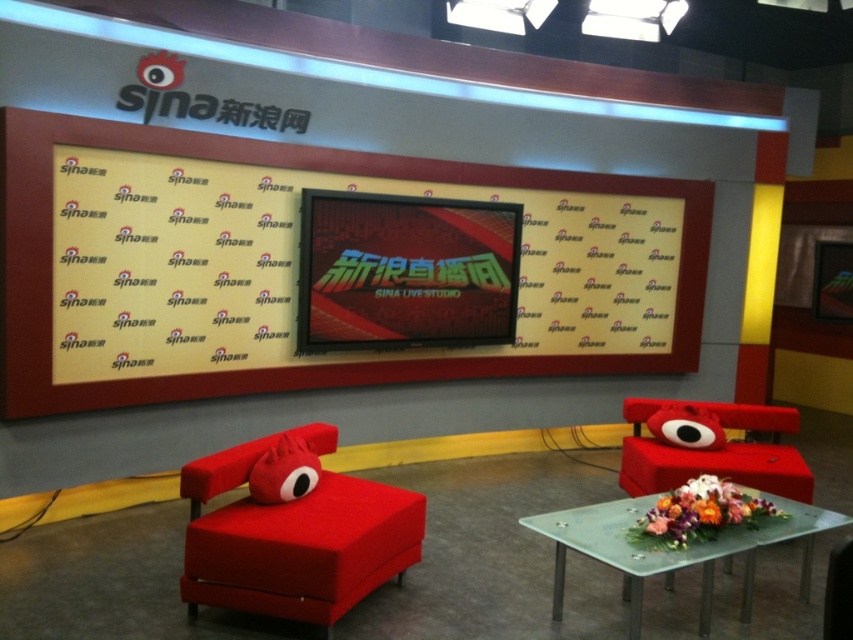
Does transparent glass table at lower right have a greater height compared to matte red armchair at center?

No.

Measure the distance from transparent glass table at lower right to matte red armchair at center.

A distance of 86.43 centimeters exists between transparent glass table at lower right and matte red armchair at center.

Measure the distance between point (622,512) and camera.

Point (622,512) is 3.41 meters from camera.

The image size is (853, 640). I want to click on transparent glass table at lower right, so click(x=674, y=548).

Describe the element at coordinates (293, 531) in the screenshot. I see `matte red chair at center` at that location.

Is point (315, 600) more distant than point (781, 412)?

No, (315, 600) is closer to viewer.

Between point (329, 545) and point (734, 448), which one is positioned in front?

Point (329, 545) is in front.

Identify the location of matte red chair at center. This screenshot has height=640, width=853. (293, 531).

Is transparent glass table at lower right smaller than matte red pillow at center?

Actually, transparent glass table at lower right might be larger than matte red pillow at center.

Can you confirm if transparent glass table at lower right is thinner than matte red pillow at center?

In fact, transparent glass table at lower right might be wider than matte red pillow at center.

Which is in front, point (607, 557) or point (289, 474)?

Positioned in front is point (607, 557).

The image size is (853, 640). Find the location of `transparent glass table at lower right`. transparent glass table at lower right is located at coordinates (674, 548).